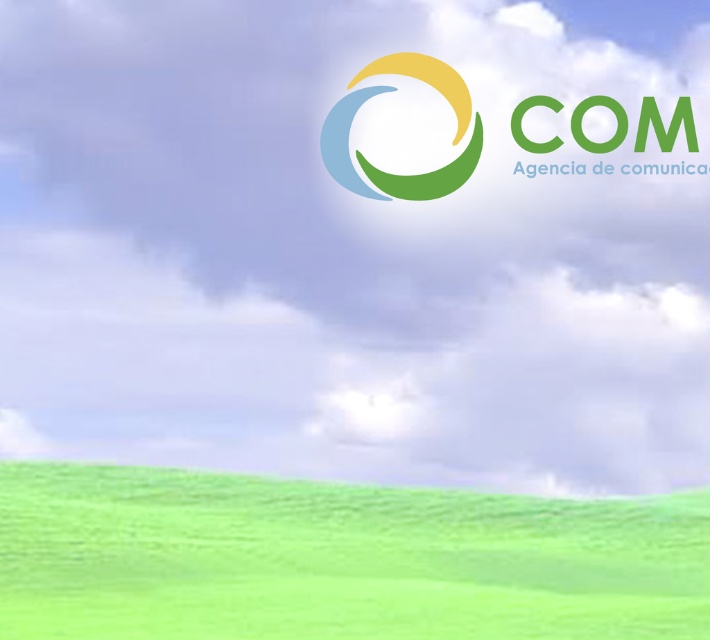
Question: Is green grassy field at lower center further to camera compared to matte plastic logo at center?

Choices:
 (A) yes
 (B) no

Answer: (B)

Question: Is green grassy field at lower center to the right of matte plastic logo at center from the viewer's perspective?

Choices:
 (A) yes
 (B) no

Answer: (B)

Question: Which object is closer to the camera taking this photo?

Choices:
 (A) matte plastic logo at center
 (B) green grassy field at lower center

Answer: (B)

Question: Is green grassy field at lower center below matte plastic logo at center?

Choices:
 (A) yes
 (B) no

Answer: (A)

Question: Which point is closer to the camera taking this photo?

Choices:
 (A) (297, 538)
 (B) (427, 198)

Answer: (A)